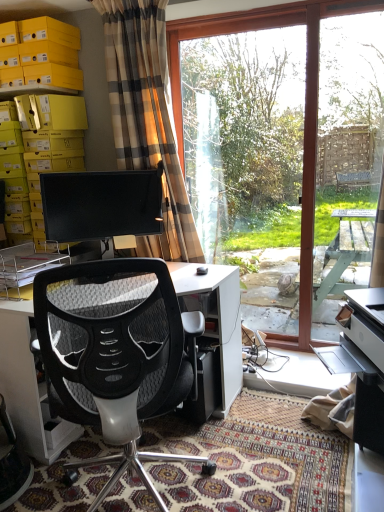
Identify the location of vacant space situated above transparent glass window at center (from a real-world perspective). (231, 18).